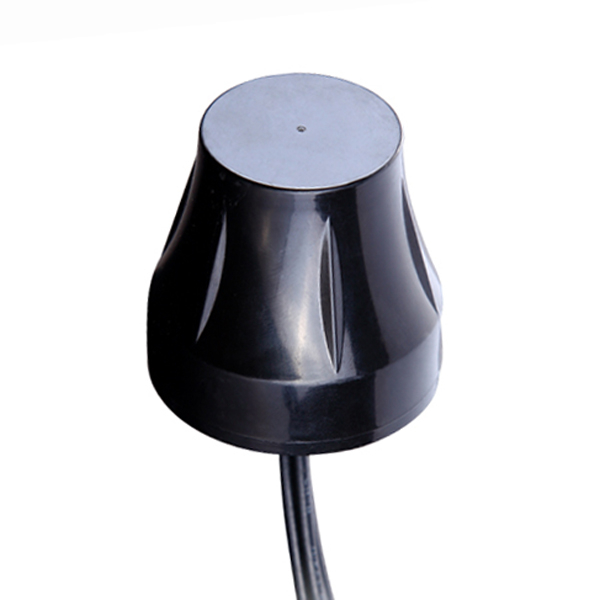
Identify the location of cable. (310, 542).